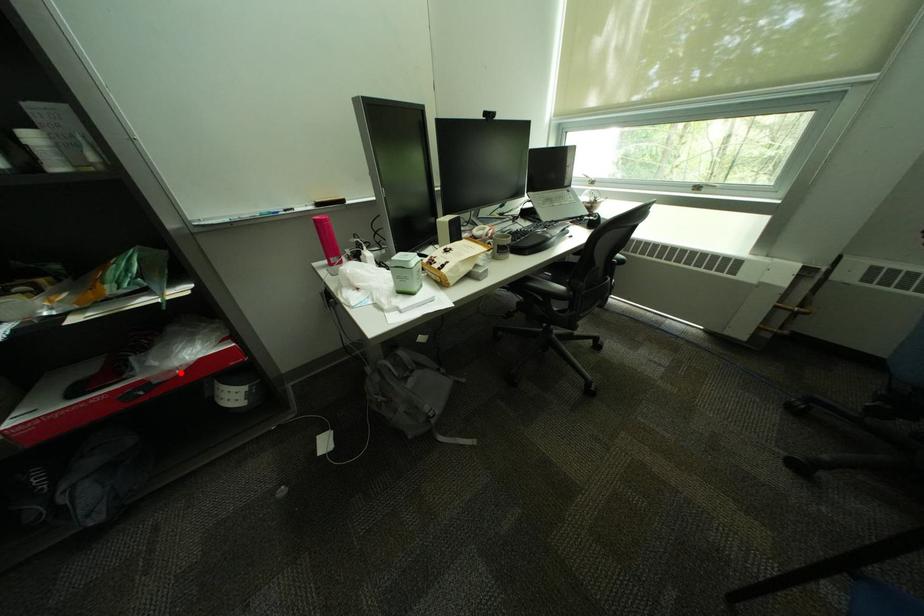
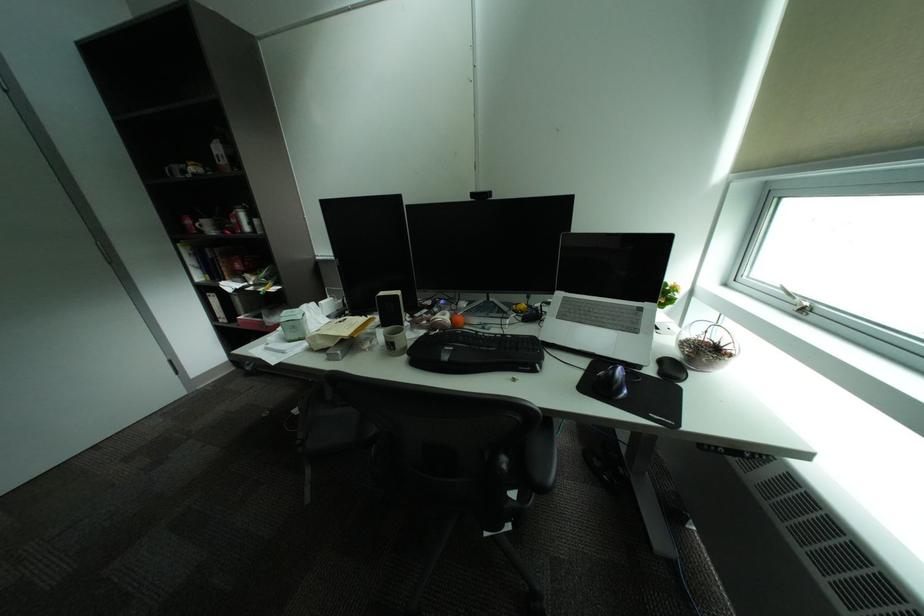
Locate, in the second image, the point that corresponds to the highlighted location in the first image.

(281, 323)